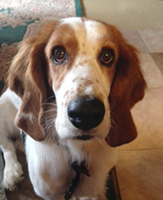
Find the location of a particular element. The width and height of the screenshot is (163, 200). carpet under the dog is located at coordinates (15, 13), (69, 8), (15, 42), (4, 78), (26, 189), (113, 194).